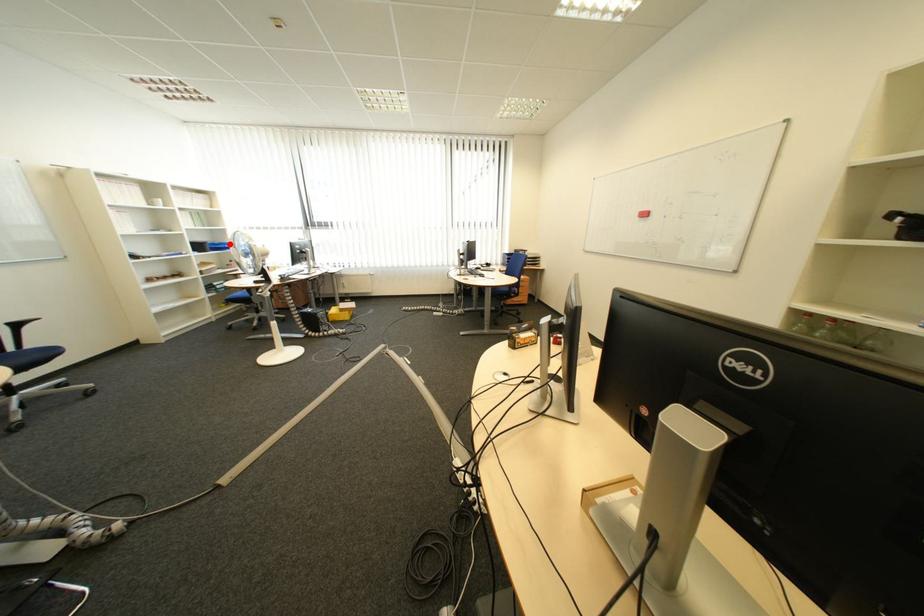
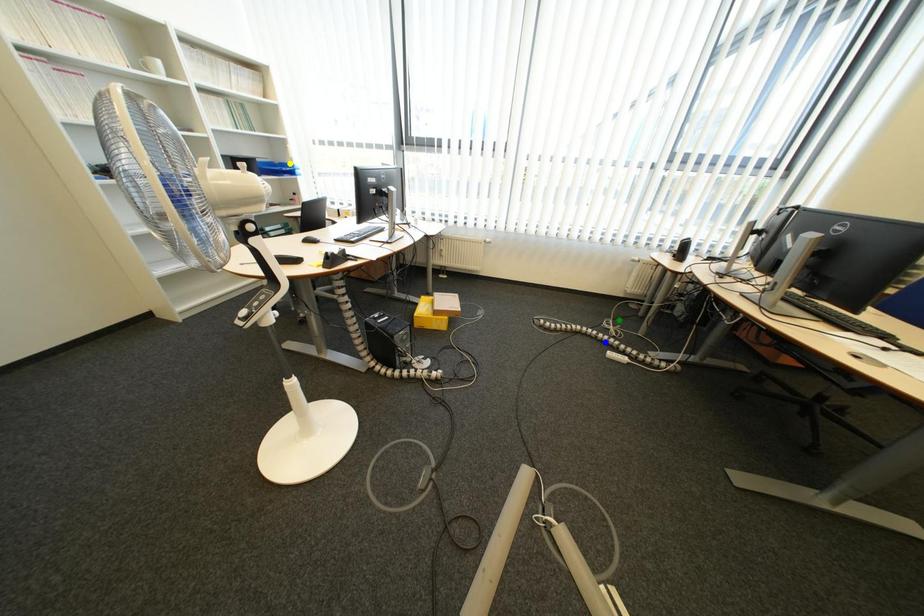
Question: I am providing you with two images of the same scene from different viewpoints. A red point is marked on the first image. You are given multiple points on the second image. Which spot in image 2 lines up with the point in image 1?

Choices:
 (A) blue point
 (B) green point
 (C) yellow point

Answer: (C)